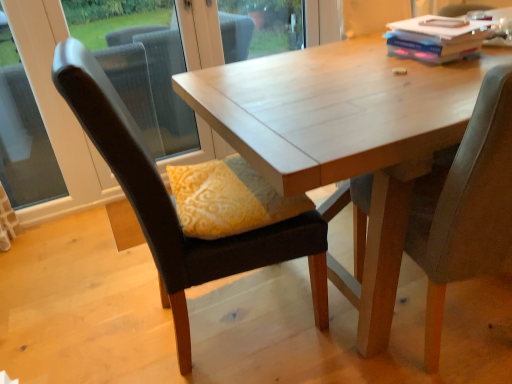
Question: Is hardcover book at upper right to the left of wooden table at center from the viewer's perspective?

Choices:
 (A) yes
 (B) no

Answer: (A)

Question: Is hardcover book at upper right completely or partially outside of wooden table at center?

Choices:
 (A) no
 (B) yes

Answer: (A)

Question: From a real-world perspective, does hardcover book at upper right stand above wooden table at center?

Choices:
 (A) no
 (B) yes

Answer: (B)

Question: Does hardcover book at upper right have a lesser height compared to wooden table at center?

Choices:
 (A) no
 (B) yes

Answer: (B)

Question: Does hardcover book at upper right have a lesser width compared to wooden table at center?

Choices:
 (A) yes
 (B) no

Answer: (A)

Question: Considering the relative positions of hardcover book at upper right and wooden table at center in the image provided, is hardcover book at upper right to the right of wooden table at center from the viewer's perspective?

Choices:
 (A) no
 (B) yes

Answer: (A)

Question: Can you confirm if wooden table at center is bigger than transparent glass window at left?

Choices:
 (A) no
 (B) yes

Answer: (B)

Question: Considering the relative sizes of wooden table at center and transparent glass window at left in the image provided, is wooden table at center shorter than transparent glass window at left?

Choices:
 (A) yes
 (B) no

Answer: (A)

Question: Can you confirm if wooden table at center is positioned to the right of transparent glass window at left?

Choices:
 (A) yes
 (B) no

Answer: (A)

Question: From a real-world perspective, is wooden table at center on transparent glass window at left?

Choices:
 (A) yes
 (B) no

Answer: (B)

Question: Can you confirm if wooden table at center is thinner than transparent glass window at left?

Choices:
 (A) no
 (B) yes

Answer: (A)

Question: From the image's perspective, is wooden table at center on top of transparent glass window at left?

Choices:
 (A) yes
 (B) no

Answer: (B)

Question: From the image's perspective, does wooden table at center appear lower than velvet dark brown chair at center, which appears as the second chair when viewed from the right?

Choices:
 (A) no
 (B) yes

Answer: (A)